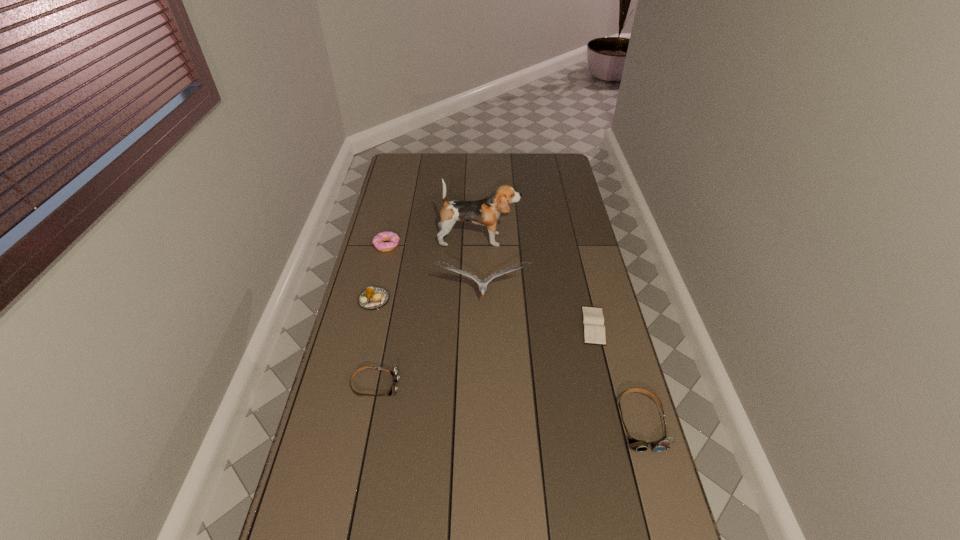
The image size is (960, 540). Identify the location of the shorter goggles. (395, 373).

You are a GUI agent. You are given a task and a screenshot of the screen. Output one action in this format:
    pyautogui.click(x=<x>, y=<y>)
    Task: Click on the taller goggles
    Image resolution: width=960 pixels, height=540 pixels.
    Given the screenshot: What is the action you would take?
    pyautogui.click(x=638, y=445)

You are a GUI agent. You are given a task and a screenshot of the screen. Output one action in this format:
    pyautogui.click(x=<x>, y=<y>)
    Task: Click on the third tallest object
    The height and width of the screenshot is (540, 960).
    Given the screenshot: What is the action you would take?
    pyautogui.click(x=638, y=445)

What are the coordinates of `doughnut` in the screenshot? It's located at (378, 241).

The width and height of the screenshot is (960, 540). Identify the location of puppy. (485, 212).

This screenshot has height=540, width=960. I want to click on the shortest object, so pos(593,320).

Locate an element on the screen. pastry is located at coordinates (372, 298).

The height and width of the screenshot is (540, 960). I want to click on the sixth shortest object, so click(x=482, y=284).

The image size is (960, 540). Find the location of `vacant space located 0.170m on the front-facing side of the left goggles`. vacant space located 0.170m on the front-facing side of the left goggles is located at coordinates (454, 385).

This screenshot has width=960, height=540. In order to click on vacant space situated 0.110m on the front-facing side of the right goggles in this screenshot , I will do `click(661, 495)`.